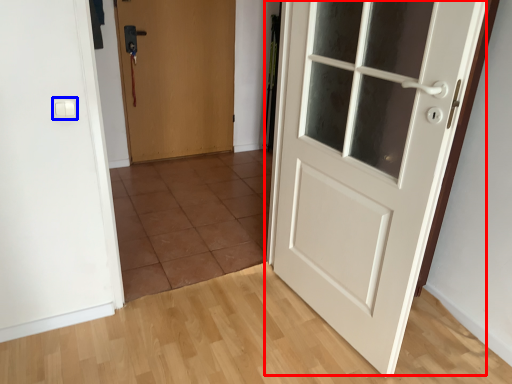
Question: Which of the following is the closest to the observer, door (highlighted by a red box) or light switch (highlighted by a blue box)?

Choices:
 (A) door
 (B) light switch

Answer: (A)